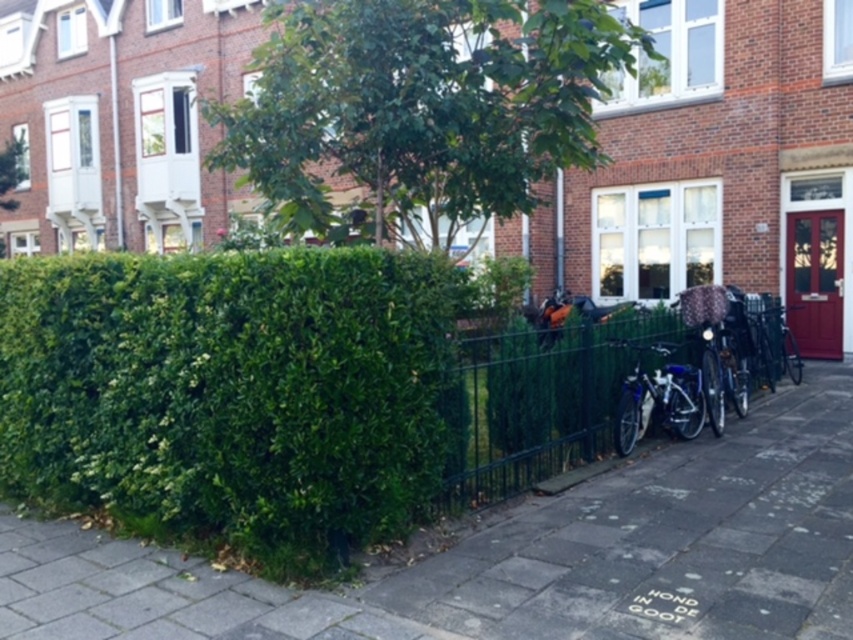
Is green leafy hedge at center to the left of green leafy hedge at lower left from the viewer's perspective?

Yes, green leafy hedge at center is to the left of green leafy hedge at lower left.

This screenshot has width=853, height=640. I want to click on green leafy hedge at center, so click(x=229, y=394).

Who is more distant from viewer, [177,385] or [621,515]?

Positioned behind is point [621,515].

Locate an element on the screen. This screenshot has height=640, width=853. green leafy hedge at center is located at coordinates (229, 394).

Where is `shiny blue bicycle at center`? The height and width of the screenshot is (640, 853). shiny blue bicycle at center is located at coordinates (657, 397).

Consider the image. Who is higher up, shiny blue bicycle at center or green leafy tree at upper left?

green leafy tree at upper left is higher up.

Locate an element on the screen. The height and width of the screenshot is (640, 853). shiny blue bicycle at center is located at coordinates (657, 397).

Find the location of a particular element. Image resolution: width=853 pixels, height=640 pixels. shiny blue bicycle at center is located at coordinates (657, 397).

Can you confirm if green leafy hedge at center is positioned above green leafy tree at center?

No, green leafy hedge at center is not above green leafy tree at center.

Which is behind, point (282, 492) or point (608, 61)?

Point (608, 61)

What do you see at coordinates (229, 394) in the screenshot?
I see `green leafy hedge at center` at bounding box center [229, 394].

The width and height of the screenshot is (853, 640). I want to click on green leafy hedge at center, so click(229, 394).